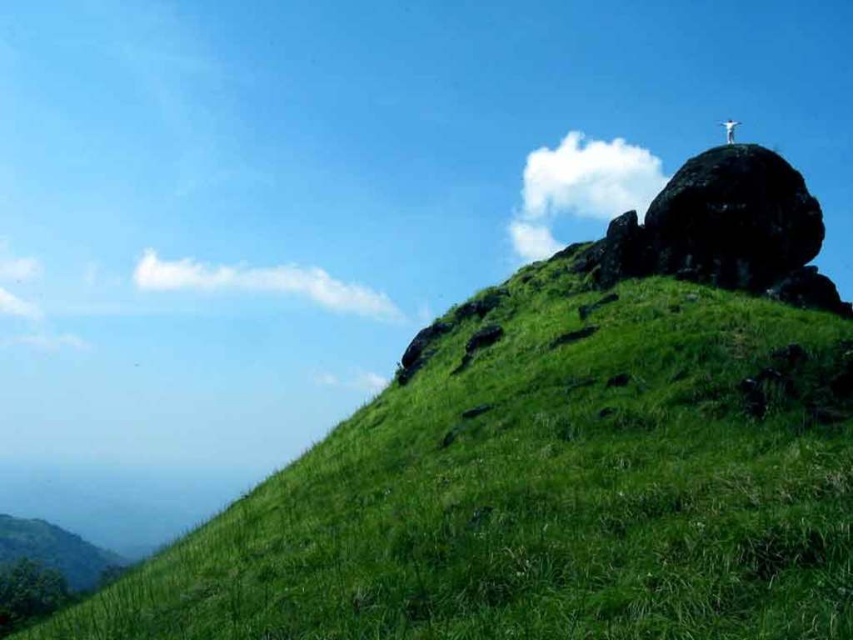
Can you confirm if dark gray rocky outcrop at upper right is positioned above white stone cross at upper right?

No, dark gray rocky outcrop at upper right is not above white stone cross at upper right.

Does dark gray rocky outcrop at upper right lie behind white stone cross at upper right?

That is False.

Who is more forward, (741, 257) or (737, 122)?

Point (741, 257) is more forward.

The image size is (853, 640). I want to click on dark gray rocky outcrop at upper right, so click(x=724, y=230).

Identify the location of green grassy hillside at upper right. The width and height of the screenshot is (853, 640). (544, 486).

Is green grassy hillside at upper right below white stone cross at upper right?

Indeed, green grassy hillside at upper right is positioned under white stone cross at upper right.

Between point (354, 612) and point (730, 141), which one is positioned behind?

Positioned behind is point (730, 141).

Image resolution: width=853 pixels, height=640 pixels. In order to click on green grassy hillside at upper right in this screenshot , I will do (x=544, y=486).

Which is more to the right, green grassy hillside at upper right or dark gray rocky outcrop at upper right?

dark gray rocky outcrop at upper right is more to the right.

Is green grassy hillside at upper right to the right of dark gray rocky outcrop at upper right from the viewer's perspective?

In fact, green grassy hillside at upper right is to the left of dark gray rocky outcrop at upper right.

Locate an element on the screen. The image size is (853, 640). green grassy hillside at upper right is located at coordinates [544, 486].

Where is `green grassy hillside at upper right`? green grassy hillside at upper right is located at coordinates (544, 486).